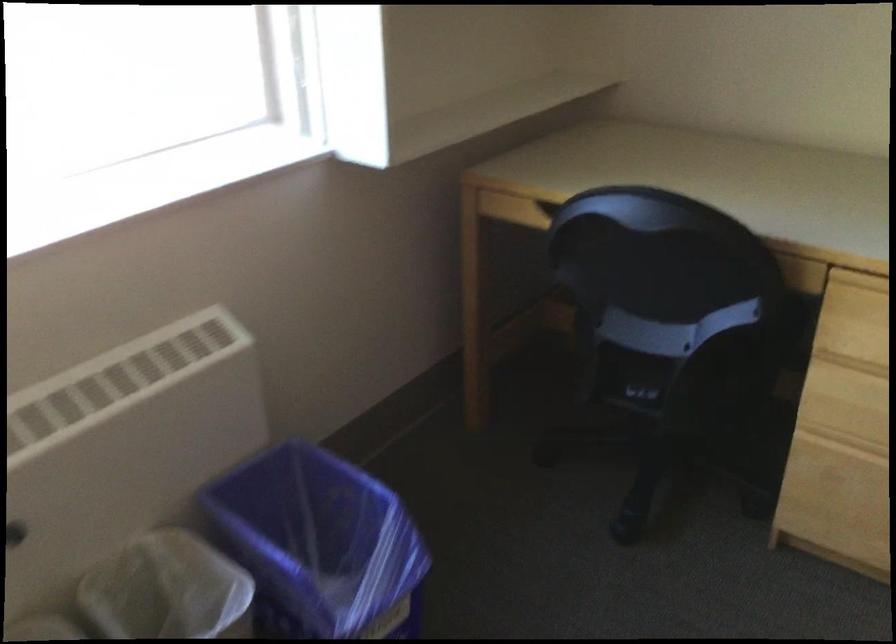
The images are taken continuously from a first-person perspective. In which direction is your viewpoint rotating?

The rotation direction of the camera is left-down.